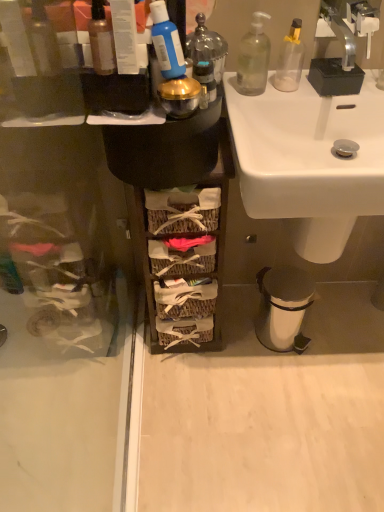
Question: Should I look upward or downward to see shiny metallic container at upper center, the 2th toiletry positioned from the front?

Choices:
 (A) down
 (B) up

Answer: (B)

Question: Would you say shiny metallic container at upper center, the 2th toiletry positioned from the front, contains blue matte toothpaste tube at upper center, acting as the first toiletry starting from the front?

Choices:
 (A) yes
 (B) no

Answer: (B)

Question: Is shiny metallic container at upper center, arranged as the first toiletry when viewed from the back, turned away from blue matte toothpaste tube at upper center, the 2th toiletry from the back?

Choices:
 (A) no
 (B) yes

Answer: (A)

Question: From a real-world perspective, does shiny metallic container at upper center, arranged as the first toiletry when viewed from the back, stand above blue matte toothpaste tube at upper center, acting as the first toiletry starting from the front?

Choices:
 (A) no
 (B) yes

Answer: (A)

Question: Is shiny metallic container at upper center, the 2th toiletry positioned from the front, taller than blue matte toothpaste tube at upper center, acting as the first toiletry starting from the front?

Choices:
 (A) no
 (B) yes

Answer: (B)

Question: Is shiny metallic container at upper center, arranged as the first toiletry when viewed from the back, positioned far away from blue matte toothpaste tube at upper center, the 2th toiletry from the back?

Choices:
 (A) no
 (B) yes

Answer: (A)

Question: Considering the relative sizes of shiny metallic container at upper center, the 2th toiletry positioned from the front, and blue matte toothpaste tube at upper center, the 2th toiletry from the back, in the image provided, is shiny metallic container at upper center, the 2th toiletry positioned from the front, wider than blue matte toothpaste tube at upper center, the 2th toiletry from the back,?

Choices:
 (A) yes
 (B) no

Answer: (A)

Question: Is woven wood baskets at center completely or partially inside silver metallic faucet at upper right?

Choices:
 (A) yes
 (B) no

Answer: (B)

Question: From the image's perspective, does silver metallic faucet at upper right appear higher than woven wood baskets at center?

Choices:
 (A) no
 (B) yes

Answer: (B)

Question: Could you tell me if silver metallic faucet at upper right is turned towards woven wood baskets at center?

Choices:
 (A) no
 (B) yes

Answer: (A)

Question: Considering the relative sizes of silver metallic faucet at upper right and woven wood baskets at center in the image provided, is silver metallic faucet at upper right smaller than woven wood baskets at center?

Choices:
 (A) yes
 (B) no

Answer: (A)

Question: Is silver metallic faucet at upper right positioned before woven wood baskets at center?

Choices:
 (A) no
 (B) yes

Answer: (B)

Question: Is silver metallic faucet at upper right with woven wood baskets at center?

Choices:
 (A) no
 (B) yes

Answer: (A)

Question: From the image's perspective, is clear glass bottle at upper right, which is the 2th bottle from front to back, under woven wood baskets at center?

Choices:
 (A) yes
 (B) no

Answer: (B)